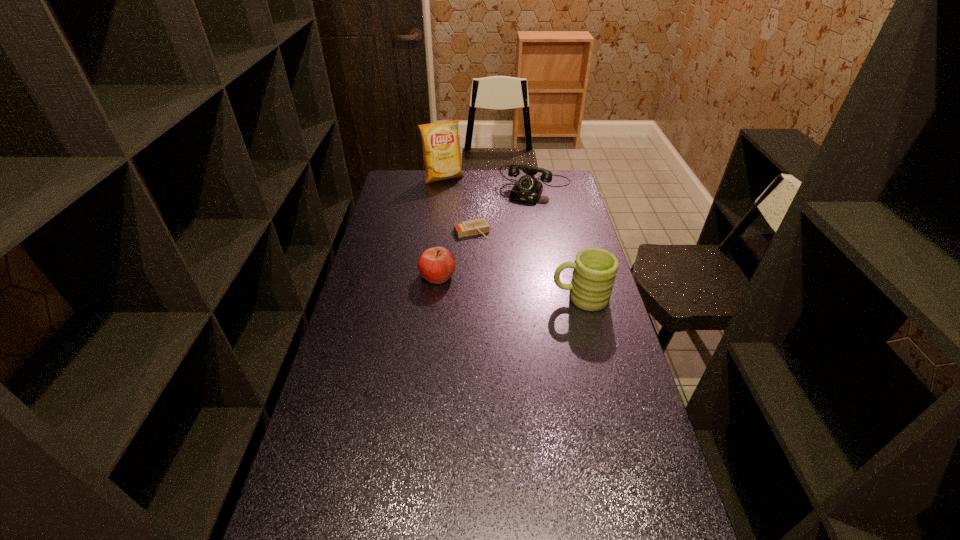
Point out which object is positioned as the fourth nearest to the crisp (potato chip). Please provide its 2D coordinates. Your answer should be formatted as a tuple, i.e. [(x, y)], where the tuple contains the x and y coordinates of a point satisfying the conditions above.

[(595, 269)]

Find the location of a particular element. The width and height of the screenshot is (960, 540). vacant region that satisfies the following two spatial constraints: 1. on the front side of the third nearest object; 2. on the side of the second tallest object with the handle is located at coordinates point(470,298).

This screenshot has height=540, width=960. Find the location of `vacant point that satisfies the following two spatial constraints: 1. on the front side of the telephone; 2. on the right side of the tallest object`. vacant point that satisfies the following two spatial constraints: 1. on the front side of the telephone; 2. on the right side of the tallest object is located at coordinates (442, 189).